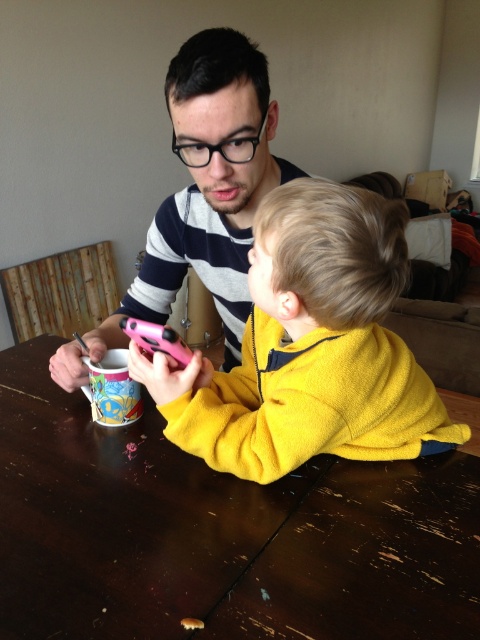
You are standing in a room where there is a wooden table at center and a pink plastic phone at center. Which object is positioned to the right side?

The wooden table at center is to the right of the pink plastic phone at center.

Based on the photo, you are standing in the room where the two people are seated at the wooden table. You need to place a small vase between the two points labeled point (152, 561) and point (157, 333). Which point should the vase be closer to so it is placed in front of the other point?

The vase should be closer to point (152, 561) because it is in front of point (157, 333).

You are a photographer trying to capture a candid shot of the two people at the wooden table. You want to ensure the yellow fleece jacket at center and the pink plastic phone at center are both in the frame. Based on their positions, which object should you position closer to the left side of your camera viewfinder to include both?

Since the yellow fleece jacket at center is to the right of the pink plastic phone at center, you should position the pink plastic phone at center closer to the left side of your camera viewfinder to include both objects in the frame.